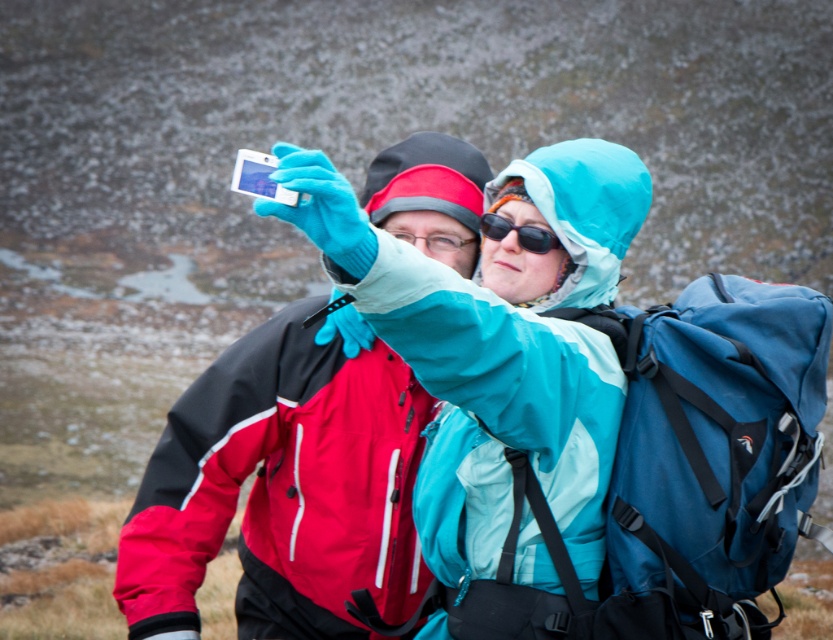
Is blue fabric backpack at right wider than black plastic sunglasses at center?

Yes, blue fabric backpack at right is wider than black plastic sunglasses at center.

Who is more distant from viewer, (676, 328) or (497, 241)?

Positioned behind is point (497, 241).

The width and height of the screenshot is (833, 640). Identify the location of blue fabric backpack at right. (712, 452).

Can you confirm if matte blue jacket at center is thinner than black plastic sunglasses at center?

In fact, matte blue jacket at center might be wider than black plastic sunglasses at center.

Identify the location of matte blue jacket at center. (287, 481).

Which is behind, point (308, 227) or point (499, 236)?

The point (499, 236) is more distant.

The image size is (833, 640). What are the coordinates of `matte blue jacket at center` in the screenshot? It's located at (287, 481).

Can you confirm if matte blue jacket at center is positioned to the right of blue fabric backpack at right?

In fact, matte blue jacket at center is to the left of blue fabric backpack at right.

Find the location of a particular element. The image size is (833, 640). matte blue jacket at center is located at coordinates (287, 481).